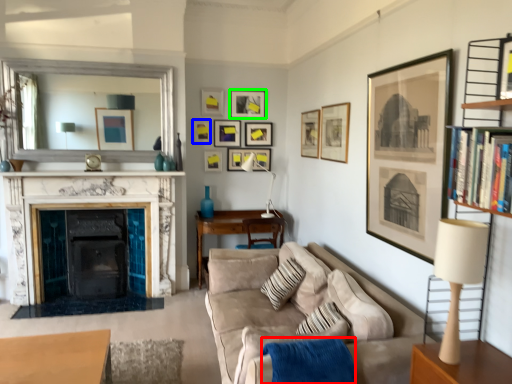
Question: Which is nearer to the blanket (highlighted by a red box)? picture frame (highlighted by a blue box) or picture frame (highlighted by a green box).

Choices:
 (A) picture frame
 (B) picture frame

Answer: (A)